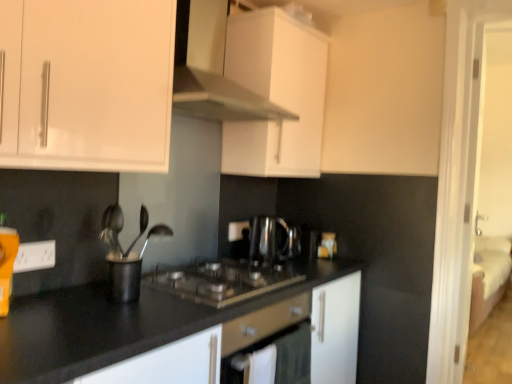
This screenshot has height=384, width=512. Identify the location of free space above black granite countertop at center (from a real-world perspective). (221, 280).